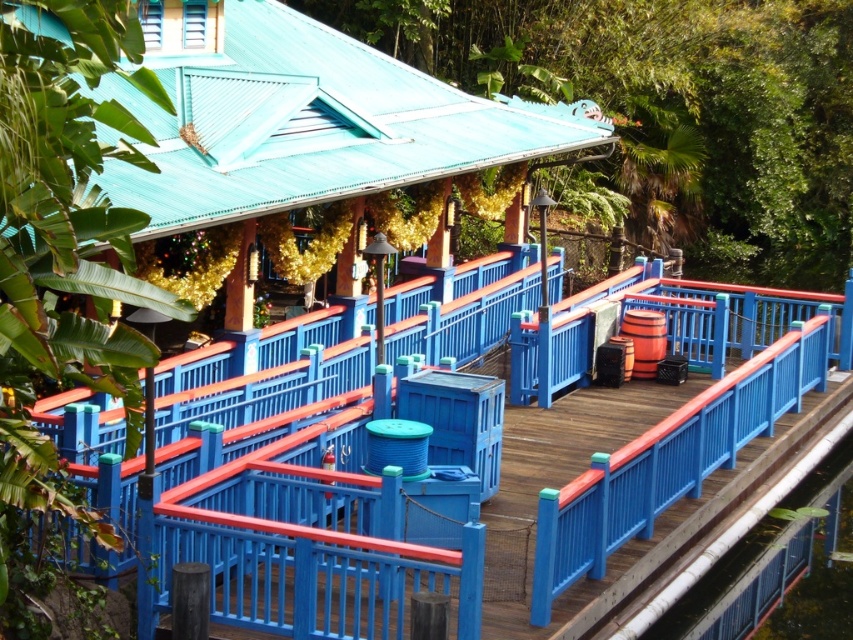
Question: Does blue painted wood deck at center appear under clear plastic water at lower right?

Choices:
 (A) yes
 (B) no

Answer: (B)

Question: Which object is closer to the camera taking this photo?

Choices:
 (A) blue painted wood deck at center
 (B) clear plastic water at lower right
 (C) blue painted wood at right

Answer: (A)

Question: Is blue painted wood deck at center above clear plastic water at lower right?

Choices:
 (A) no
 (B) yes

Answer: (B)

Question: Which point is farther from the camera taking this photo?

Choices:
 (A) (839, 589)
 (B) (711, 460)
 (C) (560, 554)

Answer: (A)

Question: Which object is the closest to the clear plastic water at lower right?

Choices:
 (A) blue painted wood at right
 (B) blue painted wood deck at center

Answer: (A)

Question: Does blue painted wood at right appear on the left side of clear plastic water at lower right?

Choices:
 (A) yes
 (B) no

Answer: (A)